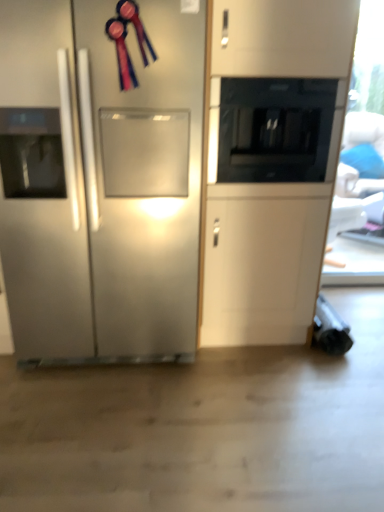
Describe the element at coordinates (100, 179) in the screenshot. I see `stainless steel refrigerator at left` at that location.

This screenshot has height=512, width=384. I want to click on stainless steel refrigerator at left, so click(x=100, y=179).

Describe the element at coordinates (274, 129) in the screenshot. This screenshot has width=384, height=512. I see `black glass microwave at upper center` at that location.

This screenshot has height=512, width=384. In order to click on black glass microwave at upper center in this screenshot , I will do `click(274, 129)`.

At what (x,y) coordinates should I click in order to perform the action: click on stainless steel refrigerator at left. Please return your answer as a coordinate pair (x, y). The height and width of the screenshot is (512, 384). Looking at the image, I should click on (100, 179).

Between black glass microwave at upper center and stainless steel refrigerator at left, which one appears on the right side from the viewer's perspective?

black glass microwave at upper center.

Considering their positions, is black glass microwave at upper center located in front of or behind stainless steel refrigerator at left?

black glass microwave at upper center is positioned farther from the viewer than stainless steel refrigerator at left.

Is point (252, 116) closer or farther from the camera than point (38, 91)?

Clearly, point (252, 116) is more distant from the camera than point (38, 91).

From the image's perspective, is black glass microwave at upper center located above stainless steel refrigerator at left?

Yes, from the image's perspective, black glass microwave at upper center is above stainless steel refrigerator at left.

From a real-world perspective, is black glass microwave at upper center physically located above or below stainless steel refrigerator at left?

black glass microwave at upper center is above stainless steel refrigerator at left.

Based on the photo, considering the relative sizes of black glass microwave at upper center and stainless steel refrigerator at left in the image provided, is black glass microwave at upper center wider than stainless steel refrigerator at left?

In fact, black glass microwave at upper center might be narrower than stainless steel refrigerator at left.

From their relative heights in the image, would you say black glass microwave at upper center is taller or shorter than stainless steel refrigerator at left?

In the image, black glass microwave at upper center appears to be shorter than stainless steel refrigerator at left.

Who is bigger, black glass microwave at upper center or stainless steel refrigerator at left?

stainless steel refrigerator at left.

Would you say black glass microwave at upper center is outside stainless steel refrigerator at left?

Absolutely, black glass microwave at upper center is external to stainless steel refrigerator at left.

Is black glass microwave at upper center not close to stainless steel refrigerator at left?

No, black glass microwave at upper center is not far from stainless steel refrigerator at left.

Is black glass microwave at upper center looking in the opposite direction of stainless steel refrigerator at left?

No.

Locate an element on the screen. This screenshot has height=512, width=384. refrigerator below the black glass microwave at upper center (from the image's perspective) is located at coordinates (100, 179).

Considering the relative positions of stainless steel refrigerator at left and black glass microwave at upper center in the image provided, is stainless steel refrigerator at left to the left of black glass microwave at upper center from the viewer's perspective?

Indeed, stainless steel refrigerator at left is positioned on the left side of black glass microwave at upper center.

Which object is further away from the camera taking this photo, stainless steel refrigerator at left or black glass microwave at upper center?

black glass microwave at upper center is further away from the camera.

Considering the positions of points (71, 190) and (298, 94), is point (71, 190) closer to camera compared to point (298, 94)?

That is True.

From the image's perspective, is stainless steel refrigerator at left above or below black glass microwave at upper center?

Clearly, from the image's perspective, stainless steel refrigerator at left is below black glass microwave at upper center.

From a real-world perspective, is stainless steel refrigerator at left physically above black glass microwave at upper center?

No, from a real-world perspective, stainless steel refrigerator at left is not over black glass microwave at upper center

Which object is thinner, stainless steel refrigerator at left or black glass microwave at upper center?

Thinner between the two is black glass microwave at upper center.

Between stainless steel refrigerator at left and black glass microwave at upper center, which one has less height?

With less height is black glass microwave at upper center.

Between stainless steel refrigerator at left and black glass microwave at upper center, which one has smaller size?

With smaller size is black glass microwave at upper center.

Would you say stainless steel refrigerator at left is outside black glass microwave at upper center?

Indeed, stainless steel refrigerator at left is completely outside black glass microwave at upper center.

Are stainless steel refrigerator at left and black glass microwave at upper center located far from each other?

No, there isn't a large distance between stainless steel refrigerator at left and black glass microwave at upper center.

From the picture: Is stainless steel refrigerator at left positioned with its back to black glass microwave at upper center?

stainless steel refrigerator at left is not turned away from black glass microwave at upper center.

How many degrees apart are the facing directions of stainless steel refrigerator at left and black glass microwave at upper center?

The angle between the facing direction of stainless steel refrigerator at left and the facing direction of black glass microwave at upper center is 0.481 degrees.

How distant is stainless steel refrigerator at left from black glass microwave at upper center?

A distance of 20.25 inches exists between stainless steel refrigerator at left and black glass microwave at upper center.

Locate an element on the screen. The width and height of the screenshot is (384, 512). refrigerator on the left side of black glass microwave at upper center is located at coordinates (100, 179).

At what (x,y) coordinates should I click in order to perform the action: click on appliance to the right of stainless steel refrigerator at left. Please return your answer as a coordinate pair (x, y). The width and height of the screenshot is (384, 512). Looking at the image, I should click on (274, 129).

Where is `refrigerator on the left of the black glass microwave at upper center`? refrigerator on the left of the black glass microwave at upper center is located at coordinates (100, 179).